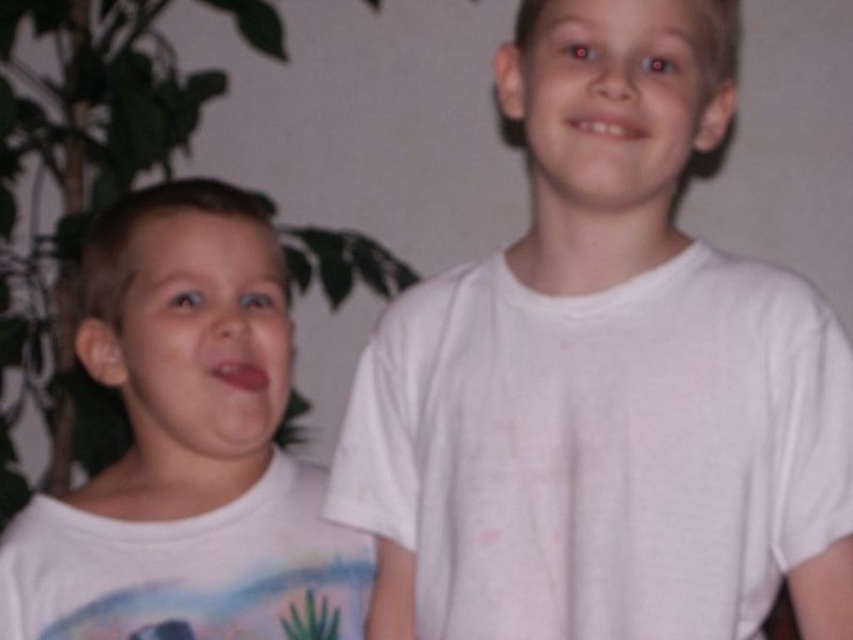
Question: Is white cotton shirt at center to the left of white matte shirt at left from the viewer's perspective?

Choices:
 (A) no
 (B) yes

Answer: (A)

Question: Is white cotton shirt at center below white matte shirt at left?

Choices:
 (A) yes
 (B) no

Answer: (B)

Question: Does white cotton shirt at center appear on the left side of white matte shirt at left?

Choices:
 (A) yes
 (B) no

Answer: (B)

Question: Among these objects, which one is nearest to the camera?

Choices:
 (A) white matte shirt at left
 (B) white cotton shirt at center

Answer: (B)